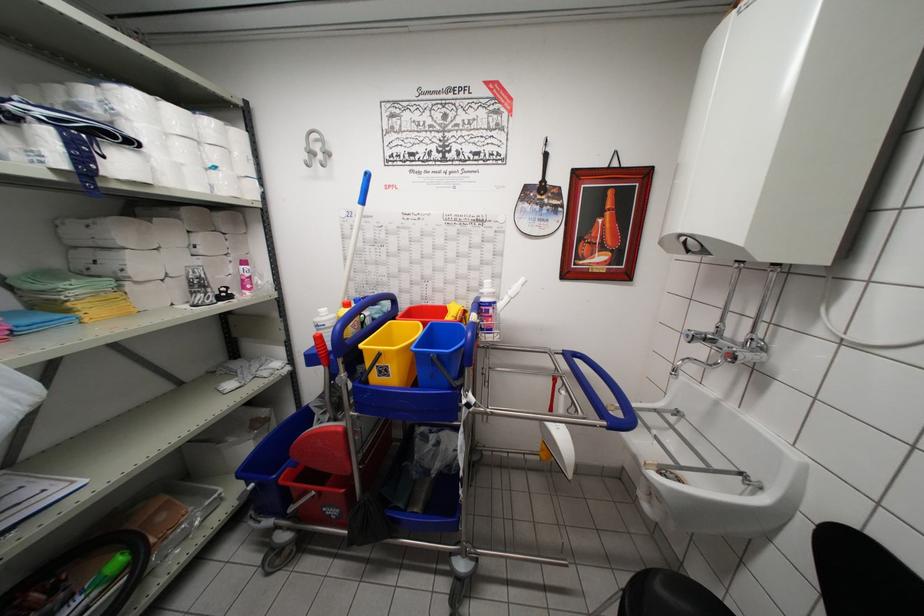
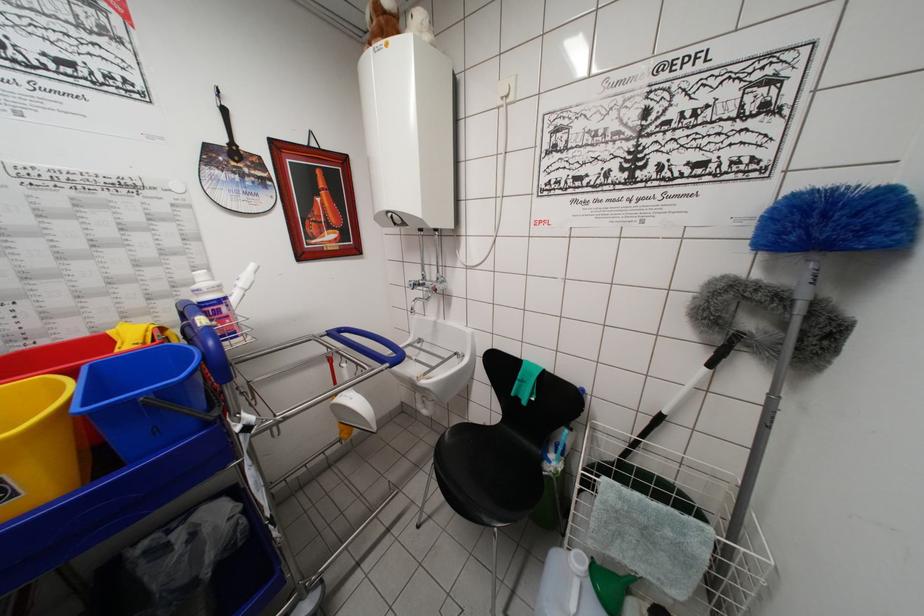
Where in the second image is the point corresponding to the point at 489,314 from the first image?

(215, 315)